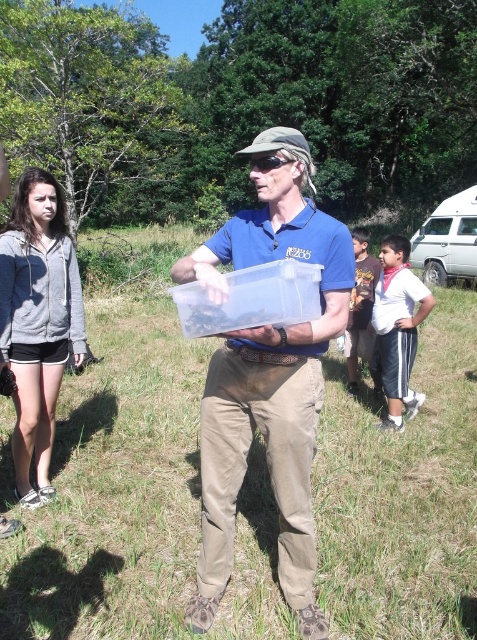
You are standing at point (38, 321). What object is located at this point?

The gray hoodie at left is located at point (38, 321).

In the scene shown: You are a photographer trying to capture a clear photo of both the gray hoodie at left and the white cotton shirt at right. Since you want both subjects to be in focus, which one should you focus on first?

You should focus on the gray hoodie at left first because it is closer to you than the white cotton shirt at right, ensuring both will be in focus when focused on the nearer subject.

You are a photographer trying to capture a photo of the gray hoodie at left and the white cotton shirt at right. Based on their positions, which one is positioned lower in the image?

The gray hoodie at left is located below the white cotton shirt at right, so it is positioned lower in the image.